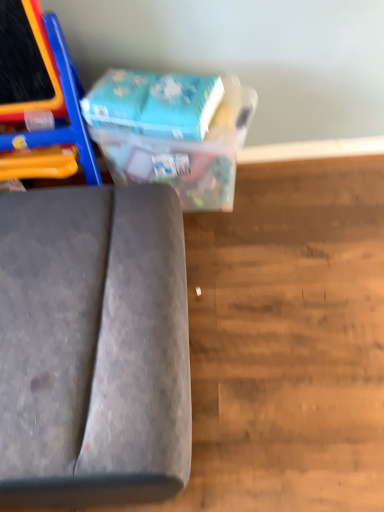
Question: Which is correct: blue cardboard box at upper center is inside blue cardboard box at upper center, or outside of it?

Choices:
 (A) inside
 (B) outside

Answer: (B)

Question: In the image, is blue cardboard box at upper center on the left side or the right side of blue cardboard box at upper center?

Choices:
 (A) left
 (B) right

Answer: (A)

Question: Based on their relative distances, which object is nearer to the blue cardboard box at upper center?

Choices:
 (A) blue cardboard box at upper center
 (B) velvet grey sofa at lower left

Answer: (A)

Question: Estimate the real-world distances between objects in this image. Which object is closer to the blue cardboard box at upper center?

Choices:
 (A) velvet grey sofa at lower left
 (B) blue cardboard box at upper center

Answer: (B)